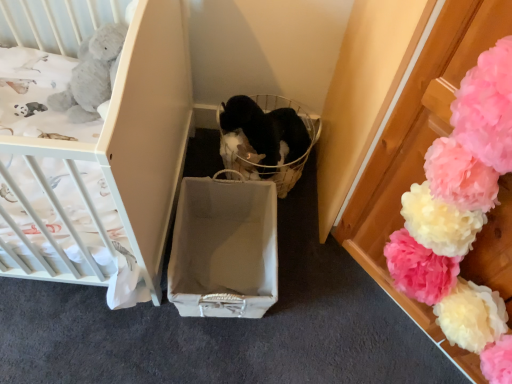
Question: Is fluffy tissue paper pom-poms at right in front of or behind matte gray cardboard box at center in the image?

Choices:
 (A) front
 (B) behind

Answer: (A)

Question: Looking at the image, does fluffy tissue paper pom-poms at right seem bigger or smaller compared to matte gray cardboard box at center?

Choices:
 (A) big
 (B) small

Answer: (A)

Question: Which of these objects is positioned farthest from the fluffy tissue paper pom-poms at right?

Choices:
 (A) matte white crib at left
 (B) matte gray cardboard box at center
 (C) black fabric basket at center

Answer: (A)

Question: Estimate the real-world distances between objects in this image. Which object is farther from the matte gray cardboard box at center?

Choices:
 (A) black fabric basket at center
 (B) matte white crib at left
 (C) fluffy tissue paper pom-poms at right

Answer: (C)